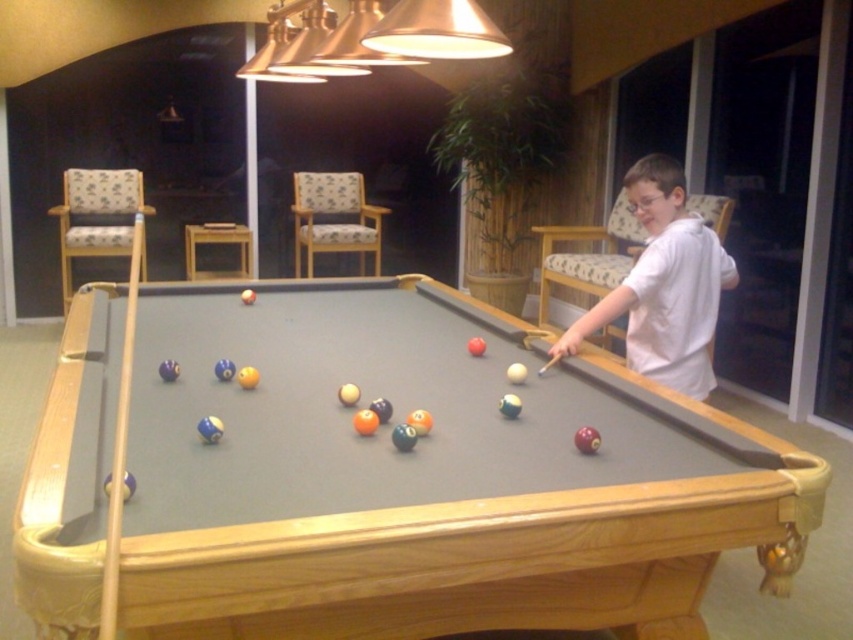
Question: Can you confirm if white cotton shirt at right is wider than wooden cue at left?

Choices:
 (A) no
 (B) yes

Answer: (B)

Question: Is wooden billiard table at center smaller than white cotton shirt at right?

Choices:
 (A) yes
 (B) no

Answer: (B)

Question: Which object is positioned closest to the wooden cue at left?

Choices:
 (A) white cotton shirt at right
 (B) wooden billiard table at center

Answer: (B)

Question: Which point is farther to the camera?

Choices:
 (A) wooden billiard table at center
 (B) wooden cue at left
 (C) white cotton shirt at right

Answer: (C)

Question: Does white cotton shirt at right appear under wooden cue at left?

Choices:
 (A) yes
 (B) no

Answer: (B)

Question: Which point is closer to the camera taking this photo?

Choices:
 (A) (674, 300)
 (B) (680, 556)

Answer: (B)